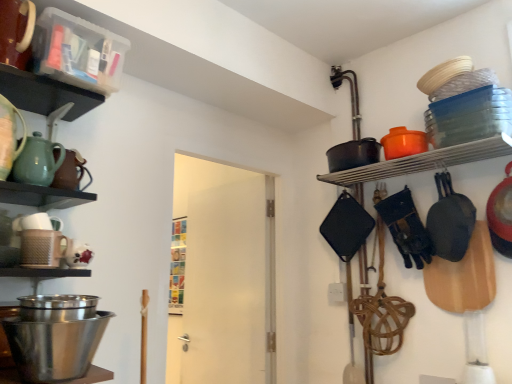
Question: Is clear plastic container at upper left, arranged as the second shelf when viewed from the right, to the left of black matte frying pan at right from the viewer's perspective?

Choices:
 (A) yes
 (B) no

Answer: (A)

Question: From a real-world perspective, is clear plastic container at upper left, arranged as the second shelf when viewed from the right, physically above black matte frying pan at right?

Choices:
 (A) no
 (B) yes

Answer: (B)

Question: From a real-world perspective, is clear plastic container at upper left, arranged as the second shelf when viewed from the right, physically below black matte frying pan at right?

Choices:
 (A) no
 (B) yes

Answer: (A)

Question: Is clear plastic container at upper left, the 1th shelf positioned from the front, taller than black matte frying pan at right?

Choices:
 (A) no
 (B) yes

Answer: (A)

Question: From the image's perspective, does clear plastic container at upper left, arranged as the 2th shelf when viewed from the back, appear lower than black matte frying pan at right?

Choices:
 (A) no
 (B) yes

Answer: (A)

Question: Is clear plastic container at upper left, arranged as the second shelf when viewed from the right, far from black matte frying pan at right?

Choices:
 (A) yes
 (B) no

Answer: (A)

Question: From the image's perspective, does matte black pot at upper right, placed as the second shelf when sorted from front to back, appear lower than black matte frying pan at right?

Choices:
 (A) yes
 (B) no

Answer: (B)

Question: From a real-world perspective, is matte black pot at upper right, which is the first shelf in right-to-left order, beneath black matte frying pan at right?

Choices:
 (A) no
 (B) yes

Answer: (A)

Question: Does matte black pot at upper right, placed as the second shelf when sorted from front to back, have a larger size compared to black matte frying pan at right?

Choices:
 (A) yes
 (B) no

Answer: (B)

Question: Can you confirm if matte black pot at upper right, the first shelf when ordered from bottom to top, is positioned to the right of black matte frying pan at right?

Choices:
 (A) yes
 (B) no

Answer: (B)

Question: Is matte black pot at upper right, which is the first shelf in right-to-left order, far from black matte frying pan at right?

Choices:
 (A) yes
 (B) no

Answer: (B)

Question: Does matte black pot at upper right, placed as the second shelf when sorted from top to bottom, turn towards black matte frying pan at right?

Choices:
 (A) no
 (B) yes

Answer: (A)

Question: From a real-world perspective, is clear plastic container at upper left, the 1th shelf positioned from the front, on matte brown teapot at left, the 1th tea pot from the back?

Choices:
 (A) yes
 (B) no

Answer: (A)